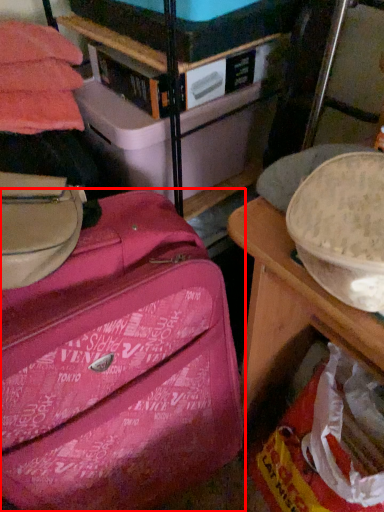
Question: Where is suitcase (annotated by the red box) located in relation to storage box in the image?

Choices:
 (A) left
 (B) right

Answer: (A)